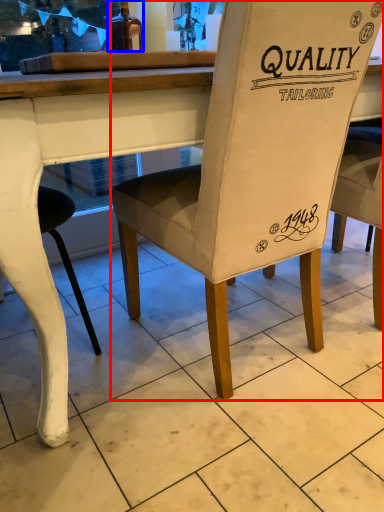
Question: Which object is further to the camera taking this photo, chair (highlighted by a red box) or bottle (highlighted by a blue box)?

Choices:
 (A) chair
 (B) bottle

Answer: (B)